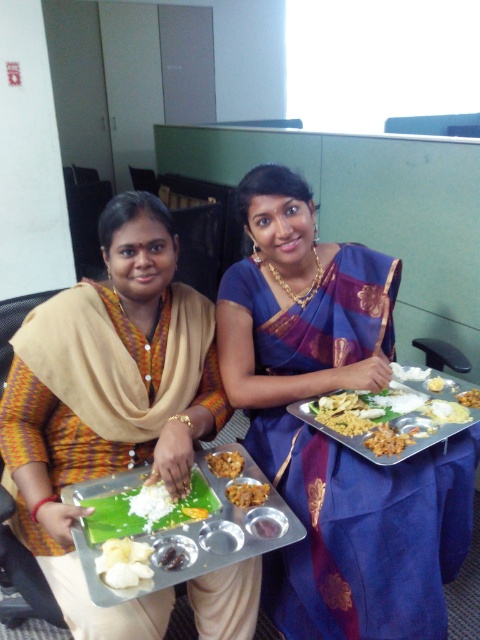
Question: Estimate the real-world distances between objects in this image. Which object is farther from the blue silk saree at center?

Choices:
 (A) golden brown rice at center
 (B) brown matte rice at center

Answer: (A)

Question: Which point appears closest to the camera in this image?

Choices:
 (A) (447, 396)
 (B) (171, 557)
 (C) (245, 490)

Answer: (B)

Question: Can you confirm if brown crumbly snack at center is positioned to the right of golden brown rice at center?

Choices:
 (A) no
 (B) yes

Answer: (A)

Question: Observing the image, what is the correct spatial positioning of blue silk saree at center in reference to yellow matte rice at center?

Choices:
 (A) above
 (B) below

Answer: (B)

Question: Estimate the real-world distances between objects in this image. Which object is closer to the golden brown crumbly pastry at center?

Choices:
 (A) blue silk saree at center
 (B) golden brown rice at center
 (C) white matte banana at center
 (D) white matte rice at center

Answer: (D)

Question: Is blue silk saree at center above white matte banana at center?

Choices:
 (A) no
 (B) yes

Answer: (B)